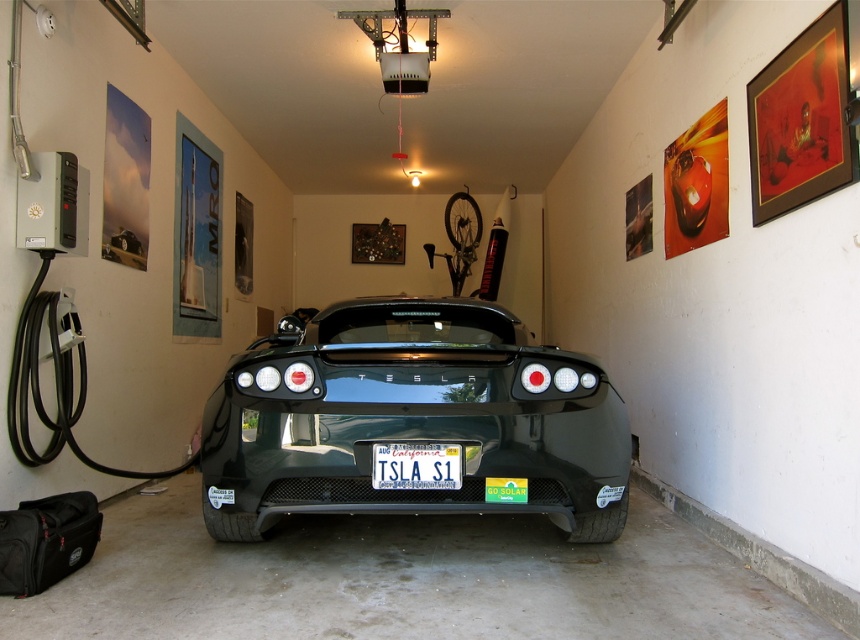
Looking at this image, which of these two, shiny black tesla at center or white plastic license plate at center, stands shorter?

white plastic license plate at center is shorter.

Describe the element at coordinates (413, 419) in the screenshot. I see `shiny black tesla at center` at that location.

You are a GUI agent. You are given a task and a screenshot of the screen. Output one action in this format:
    pyautogui.click(x=<x>, y=<y>)
    Task: Click on the shiny black tesla at center
    This screenshot has width=860, height=640.
    Given the screenshot: What is the action you would take?
    pyautogui.click(x=413, y=419)